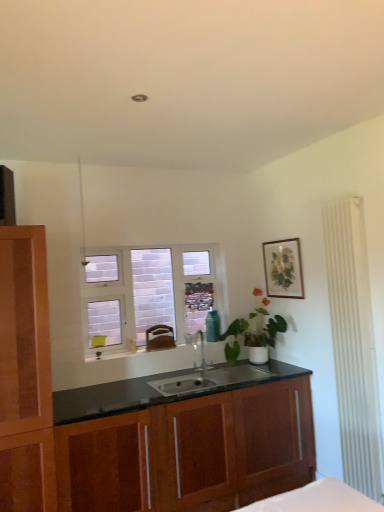
Question: Is white frosted glass window at center inside or outside of matte wooden picture frame at upper right?

Choices:
 (A) inside
 (B) outside

Answer: (B)

Question: Would you say white frosted glass window at center is to the left or to the right of matte wooden picture frame at upper right in the picture?

Choices:
 (A) right
 (B) left

Answer: (B)

Question: Which object is the farthest from the wooden cabinet at center?

Choices:
 (A) white frosted glass window at center
 (B) satin nickel faucet at center
 (C) matte wooden picture frame at upper right

Answer: (C)

Question: Which of these objects is positioned closest to the wooden cabinet at center?

Choices:
 (A) satin nickel faucet at center
 (B) white frosted glass window at center
 (C) matte wooden picture frame at upper right

Answer: (A)